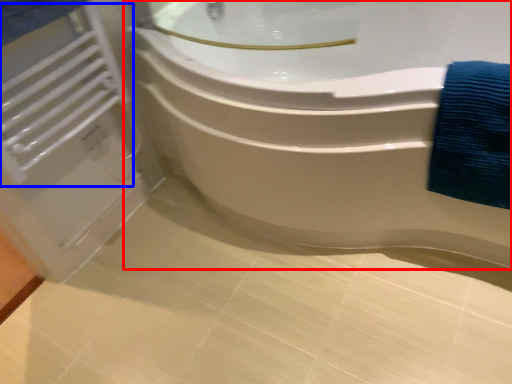
Question: Among these objects, which one is nearest to the camera, bathtub (highlighted by a red box) or radiator (highlighted by a blue box)?

Choices:
 (A) bathtub
 (B) radiator

Answer: (A)